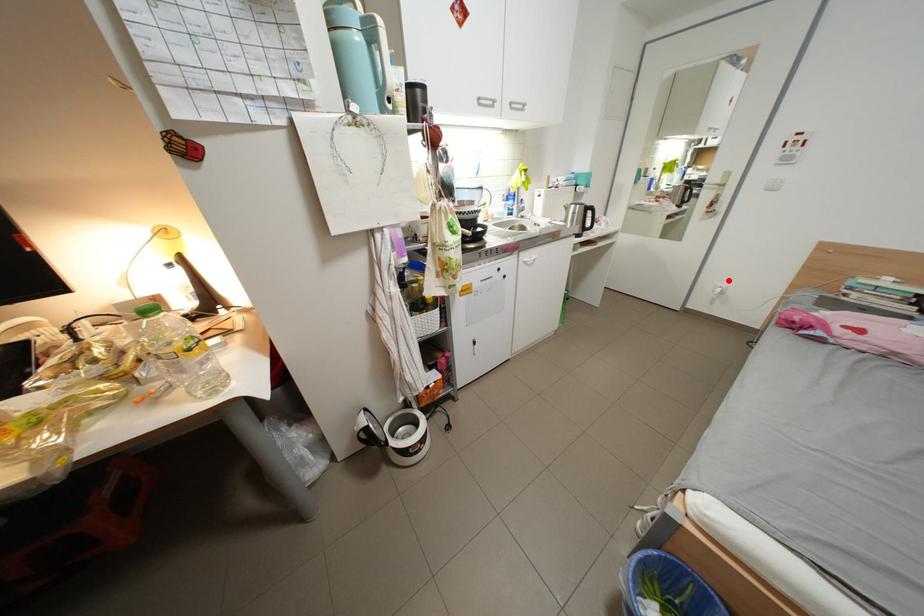
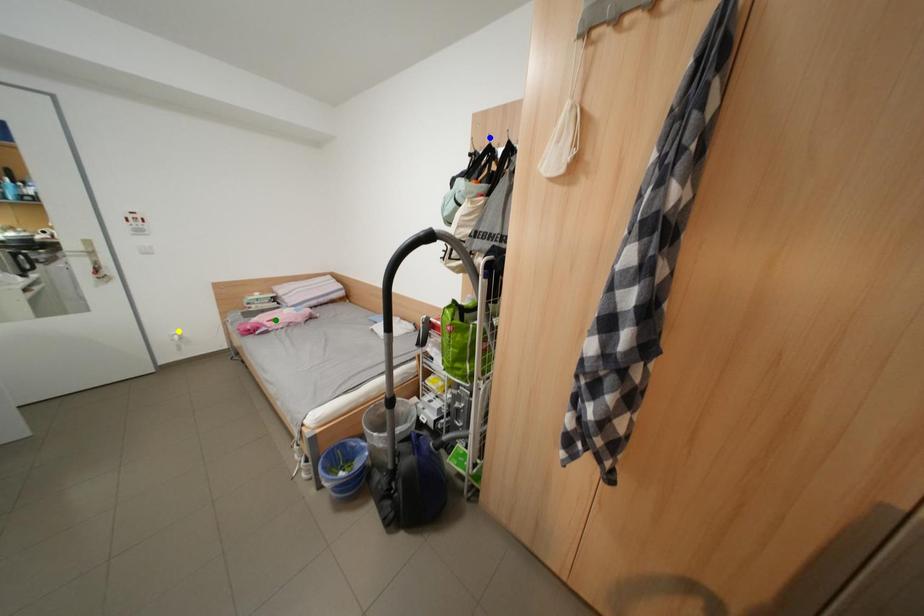
Question: I am providing you with two images of the same scene from different viewpoints. A red point is marked on the first image. You are given multiple points on the second image. In image 2, which mark is for the same physical point as the one in image 1?

Choices:
 (A) blue point
 (B) green point
 (C) yellow point

Answer: (C)